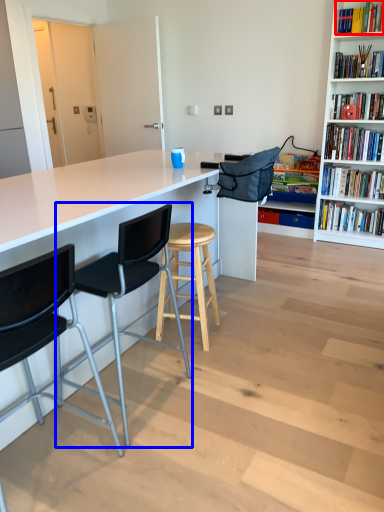
Question: Among these objects, which one is farthest to the camera, book (highlighted by a red box) or chair (highlighted by a blue box)?

Choices:
 (A) book
 (B) chair

Answer: (A)